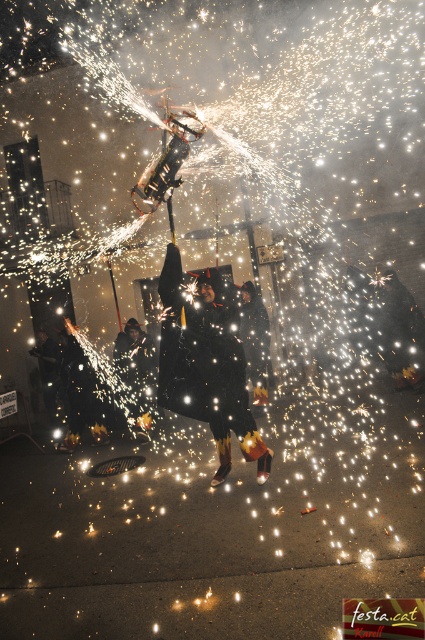
Does point (152, 397) come farther from viewer compared to point (261, 365)?

Yes.

Find the location of a particular element. The height and width of the screenshot is (640, 425). black matte jacket at center is located at coordinates (136, 376).

You are a GUI agent. You are given a task and a screenshot of the screen. Output one action in this format:
    pyautogui.click(x=<x>, y=<y>)
    Task: Click on the black matte jacket at center
    
    Given the screenshot: What is the action you would take?
    pyautogui.click(x=136, y=376)

Does black matte jacket at center have a lesser width compared to matte black jacket at lower left?

In fact, black matte jacket at center might be wider than matte black jacket at lower left.

Which is more to the right, black matte jacket at center or matte black jacket at lower left?

Positioned to the right is black matte jacket at center.

Find the location of `black matte jacket at center`. black matte jacket at center is located at coordinates (136, 376).

At what (x,y) coordinates should I click in order to perform the action: click on black matte jacket at center. Please return your answer as a coordinate pair (x, y). The width and height of the screenshot is (425, 640). Looking at the image, I should click on (136, 376).

Who is more forward, (x=65, y=360) or (x=39, y=353)?

Positioned in front is point (x=65, y=360).

Which is more to the left, shiny metallic helmet at center or matte black jacket at lower left?

matte black jacket at lower left is more to the left.

Does point (62, 442) lie in front of point (47, 352)?

Yes, point (62, 442) is in front of point (47, 352).

Identify the location of shiny metallic helmet at center. The height and width of the screenshot is (640, 425). (79, 394).